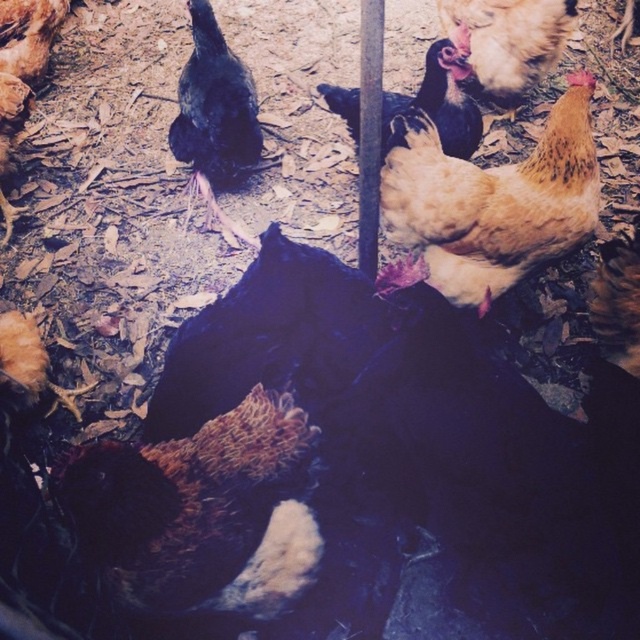
You are a farmer who needs to separate two chickens for feeding. You have a divider that is 1 meter long. The divider can only be placed between the golden feathered chicken at center and the brown speckled chicken at upper right. Will the divider be long enough to separate them?

The golden feathered chicken at center and brown speckled chicken at upper right are 1.18 meters apart from each other. Since the divider is only 1 meter long, it will not be long enough to fully separate them as the distance between them exceeds the divider length.

You are a farmer trying to locate a specific chicken in your farmyard. You remember that the black feathered chicken is at the center of the yard. Using the coordinates provided, can you determine if the point marked at (214, 115) falls within the center area of the farmyard?

The point marked at (214, 115) corresponds to the black feathered chicken at center, so yes, it is within the center area of the farmyard.